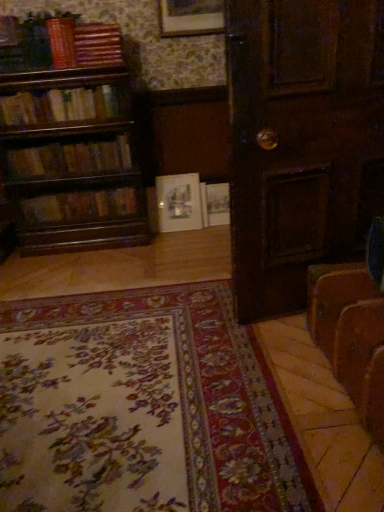
Image resolution: width=384 pixels, height=512 pixels. What are the coordinates of `free point above wooden bookshelf at left, acting as the 3th book starting from the top (from a real-world perspective)` in the screenshot? It's located at (67, 86).